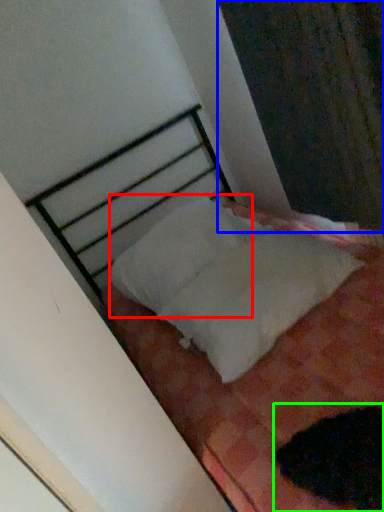
Question: Which is nearer to the pillow (highlighted by a red box)? curtain (highlighted by a blue box) or animal (highlighted by a green box).

Choices:
 (A) curtain
 (B) animal

Answer: (A)